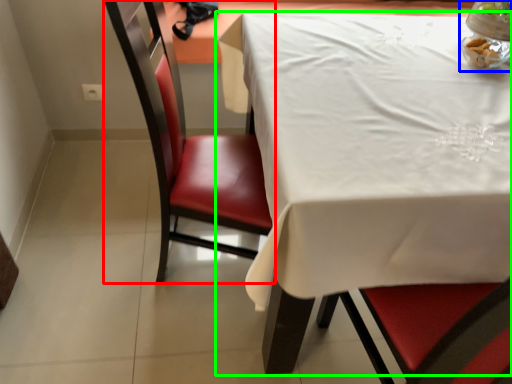
Question: Which is nearer to the chair (highlighted by a red box)? tableware (highlighted by a blue box) or table (highlighted by a green box).

Choices:
 (A) tableware
 (B) table

Answer: (B)